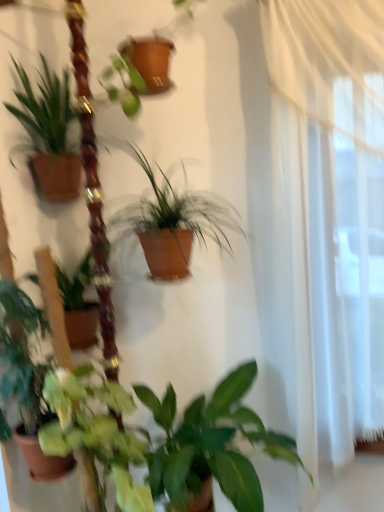
Describe the element at coordinates (172, 221) in the screenshot. I see `brown matte pot at center, the 3th houseplant when ordered from bottom to top` at that location.

Identify the location of green matte plant at left, which is the 4th houseplant from bottom to top. The width and height of the screenshot is (384, 512). (47, 134).

Image resolution: width=384 pixels, height=512 pixels. What do you see at coordinates (212, 443) in the screenshot? I see `green matte plant at lower center, which appears as the 1th houseplant when ordered from the bottom` at bounding box center [212, 443].

Locate an element on the screen. The height and width of the screenshot is (512, 384). green matte plant at left, which is the second houseplant in bottom-to-top order is located at coordinates (27, 379).

Considering the sizes of objects green matte plant at left, which is the 4th houseplant from bottom to top, and green matte leafy plant at lower center in the image provided, who is taller, green matte plant at left, which is the 4th houseplant from bottom to top, or green matte leafy plant at lower center?

green matte leafy plant at lower center.

What's the angular difference between green matte plant at left, marked as the first houseplant in a top-to-bottom arrangement, and green matte leafy plant at lower center's facing directions?

They differ by 0.528 degrees in their facing directions.

Is green matte leafy plant at lower center at the back of green matte plant at left, which is the 4th houseplant from bottom to top?

green matte plant at left, which is the 4th houseplant from bottom to top, is not turned away from green matte leafy plant at lower center.

Does green matte plant at left, which is the 4th houseplant from bottom to top, appear on the left side of green matte leafy plant at lower center?

Yes.

Is green matte plant at lower center, which appears as the 1th houseplant when ordered from the bottom, oriented away from green matte leafy plant at lower center?

No, green matte leafy plant at lower center is not at the back of green matte plant at lower center, which appears as the 1th houseplant when ordered from the bottom.

Which of these two, green matte plant at lower center, placed as the fourth houseplant when sorted from top to bottom, or green matte leafy plant at lower center, stands shorter?

Standing shorter between the two is green matte plant at lower center, placed as the fourth houseplant when sorted from top to bottom.

Considering the relative positions of green matte plant at lower center, placed as the fourth houseplant when sorted from top to bottom, and green matte leafy plant at lower center in the image provided, is green matte plant at lower center, placed as the fourth houseplant when sorted from top to bottom, behind green matte leafy plant at lower center?

Yes, the depth of green matte plant at lower center, placed as the fourth houseplant when sorted from top to bottom, is greater than that of green matte leafy plant at lower center.

Considering the positions of point (228, 404) and point (64, 380), is point (228, 404) closer or farther from the camera than point (64, 380)?

Point (228, 404) is farther from the camera than point (64, 380).

Considering the relative sizes of green matte plant at lower center, which appears as the 1th houseplant when ordered from the bottom, and green matte plant at left, the third houseplant from the top, in the image provided, is green matte plant at lower center, which appears as the 1th houseplant when ordered from the bottom, taller than green matte plant at left, the third houseplant from the top,?

Incorrect, the height of green matte plant at lower center, which appears as the 1th houseplant when ordered from the bottom, is not larger of that of green matte plant at left, the third houseplant from the top.

Is green matte plant at lower center, placed as the fourth houseplant when sorted from top to bottom, smaller than green matte plant at left, the third houseplant from the top?

No.

From the image's perspective, which object appears higher, green matte plant at lower center, placed as the fourth houseplant when sorted from top to bottom, or green matte plant at left, which is the second houseplant in bottom-to-top order?

green matte plant at left, which is the second houseplant in bottom-to-top order, appears higher in the image.

Looking at this image, from a real-world perspective, which is physically below, green matte plant at left, marked as the first houseplant in a top-to-bottom arrangement, or green matte plant at left, the third houseplant from the top?

From a 3D spatial view, green matte plant at left, the third houseplant from the top, is below.

Consider the image. Is green matte plant at left, which is the second houseplant in bottom-to-top order, completely or partially inside green matte plant at left, which is the 4th houseplant from bottom to top?

Actually, green matte plant at left, which is the second houseplant in bottom-to-top order, is outside green matte plant at left, which is the 4th houseplant from bottom to top.

Is green matte plant at left, marked as the first houseplant in a top-to-bottom arrangement, directly adjacent to green matte plant at left, the third houseplant from the top?

No, green matte plant at left, marked as the first houseplant in a top-to-bottom arrangement, is not making contact with green matte plant at left, the third houseplant from the top.

In terms of width, does green matte plant at left, marked as the first houseplant in a top-to-bottom arrangement, look wider or thinner when compared to green matte plant at left, the third houseplant from the top?

Clearly, green matte plant at left, marked as the first houseplant in a top-to-bottom arrangement, has more width compared to green matte plant at left, the third houseplant from the top.

From a real-world perspective, is green matte plant at left, the third houseplant from the top, positioned under brown matte pot at center, the 2th houseplant positioned from the top, based on gravity?

Yes, from a real-world perspective, green matte plant at left, the third houseplant from the top, is beneath brown matte pot at center, the 2th houseplant positioned from the top.

In order to click on houseplant that appears in front of the green matte plant at left, the third houseplant from the top in this screenshot , I will do `click(172, 221)`.

Based on their positions, is green matte plant at left, which is the second houseplant in bottom-to-top order, located to the left or right of brown matte pot at center, the 3th houseplant when ordered from bottom to top?

In the image, green matte plant at left, which is the second houseplant in bottom-to-top order, appears on the left side of brown matte pot at center, the 3th houseplant when ordered from bottom to top.

Is green matte leafy plant at lower center wider than green matte plant at left, marked as the first houseplant in a top-to-bottom arrangement?

Yes, green matte leafy plant at lower center is wider than green matte plant at left, marked as the first houseplant in a top-to-bottom arrangement.

Can you see green matte leafy plant at lower center touching green matte plant at left, which is the 4th houseplant from bottom to top?

green matte leafy plant at lower center is not next to green matte plant at left, which is the 4th houseplant from bottom to top, and they're not touching.

Considering the sizes of green matte leafy plant at lower center and green matte plant at left, which is the 4th houseplant from bottom to top, in the image, is green matte leafy plant at lower center taller or shorter than green matte plant at left, which is the 4th houseplant from bottom to top,?

Clearly, green matte leafy plant at lower center is taller compared to green matte plant at left, which is the 4th houseplant from bottom to top.

Between point (66, 412) and point (63, 111), which one is positioned behind?

The point (63, 111) is behind.

Which object is thinner, green matte leafy plant at lower center or brown matte pot at center, the 3th houseplant when ordered from bottom to top?

Thinner between the two is green matte leafy plant at lower center.

Is green matte leafy plant at lower center aimed at brown matte pot at center, the 3th houseplant when ordered from bottom to top?

No.

Considering the relative positions of green matte leafy plant at lower center and brown matte pot at center, the 3th houseplant when ordered from bottom to top, in the image provided, is green matte leafy plant at lower center to the left of brown matte pot at center, the 3th houseplant when ordered from bottom to top, from the viewer's perspective?

Indeed, green matte leafy plant at lower center is positioned on the left side of brown matte pot at center, the 3th houseplant when ordered from bottom to top.

At what (x,y) coordinates should I click in order to perform the action: click on houseplant that is the 3rd object above the green matte leafy plant at lower center (from a real-world perspective). Please return your answer as a coordinate pair (x, y). The image size is (384, 512). Looking at the image, I should click on (47, 134).

Locate an element on the screen. This screenshot has width=384, height=512. plant in front of the green matte plant at lower center, which appears as the 1th houseplant when ordered from the bottom is located at coordinates (95, 430).

When comparing their distances from green matte plant at lower center, placed as the fourth houseplant when sorted from top to bottom, does green matte leafy plant at lower center or brown matte pot at center, the 3th houseplant when ordered from bottom to top, seem further?

The object further to green matte plant at lower center, placed as the fourth houseplant when sorted from top to bottom, is brown matte pot at center, the 3th houseplant when ordered from bottom to top.

Estimate the real-world distances between objects in this image. Which object is further from green matte plant at lower center, which appears as the 1th houseplant when ordered from the bottom, brown matte pot at center, the 3th houseplant when ordered from bottom to top, or green matte plant at left, which is the second houseplant in bottom-to-top order?

brown matte pot at center, the 3th houseplant when ordered from bottom to top, is further to green matte plant at lower center, which appears as the 1th houseplant when ordered from the bottom.

When comparing their distances from brown matte pot at center, the 3th houseplant when ordered from bottom to top, does green matte plant at lower center, placed as the fourth houseplant when sorted from top to bottom, or green matte plant at left, the third houseplant from the top, seem further?

green matte plant at lower center, placed as the fourth houseplant when sorted from top to bottom, lies further to brown matte pot at center, the 3th houseplant when ordered from bottom to top, than the other object.

Based on the photo, looking at the image, which one is located closer to green matte plant at left, which is the 4th houseplant from bottom to top, green matte plant at lower center, placed as the fourth houseplant when sorted from top to bottom, or green matte plant at left, which is the second houseplant in bottom-to-top order?

green matte plant at left, which is the second houseplant in bottom-to-top order, is positioned closer to the anchor green matte plant at left, which is the 4th houseplant from bottom to top.

Which object lies nearer to the anchor point green matte plant at left, marked as the first houseplant in a top-to-bottom arrangement, green matte plant at lower center, placed as the fourth houseplant when sorted from top to bottom, or brown matte pot at center, the 2th houseplant positioned from the top?

brown matte pot at center, the 2th houseplant positioned from the top, is positioned closer to the anchor green matte plant at left, marked as the first houseplant in a top-to-bottom arrangement.

When comparing their distances from green matte plant at left, which is the second houseplant in bottom-to-top order, does brown matte pot at center, the 3th houseplant when ordered from bottom to top, or green matte plant at lower center, placed as the fourth houseplant when sorted from top to bottom, seem closer?

green matte plant at lower center, placed as the fourth houseplant when sorted from top to bottom.

Looking at the image, which one is located further to green matte plant at left, which is the second houseplant in bottom-to-top order, green matte plant at left, which is the 4th houseplant from bottom to top, or green matte leafy plant at lower center?

Based on the image, green matte plant at left, which is the 4th houseplant from bottom to top, appears to be further to green matte plant at left, which is the second houseplant in bottom-to-top order.

Looking at the image, which one is located closer to green matte plant at lower center, placed as the fourth houseplant when sorted from top to bottom, green matte plant at left, the third houseplant from the top, or green matte plant at left, marked as the first houseplant in a top-to-bottom arrangement?

The object closer to green matte plant at lower center, placed as the fourth houseplant when sorted from top to bottom, is green matte plant at left, the third houseplant from the top.

This screenshot has height=512, width=384. Identify the location of plant between green matte plant at left, the third houseplant from the top, and green matte plant at lower center, which appears as the 1th houseplant when ordered from the bottom, from left to right. (95, 430).

This screenshot has width=384, height=512. In order to click on plant that lies between brown matte pot at center, the 3th houseplant when ordered from bottom to top, and green matte plant at lower center, placed as the fourth houseplant when sorted from top to bottom, from top to bottom in this screenshot , I will do (95, 430).

Where is `houseplant between green matte plant at left, which is the 4th houseplant from bottom to top, and green matte plant at left, the third houseplant from the top, in the vertical direction`? houseplant between green matte plant at left, which is the 4th houseplant from bottom to top, and green matte plant at left, the third houseplant from the top, in the vertical direction is located at coordinates (172, 221).

The width and height of the screenshot is (384, 512). I want to click on houseplant between brown matte pot at center, the 3th houseplant when ordered from bottom to top, and green matte plant at lower center, placed as the fourth houseplant when sorted from top to bottom, from top to bottom, so (x=27, y=379).